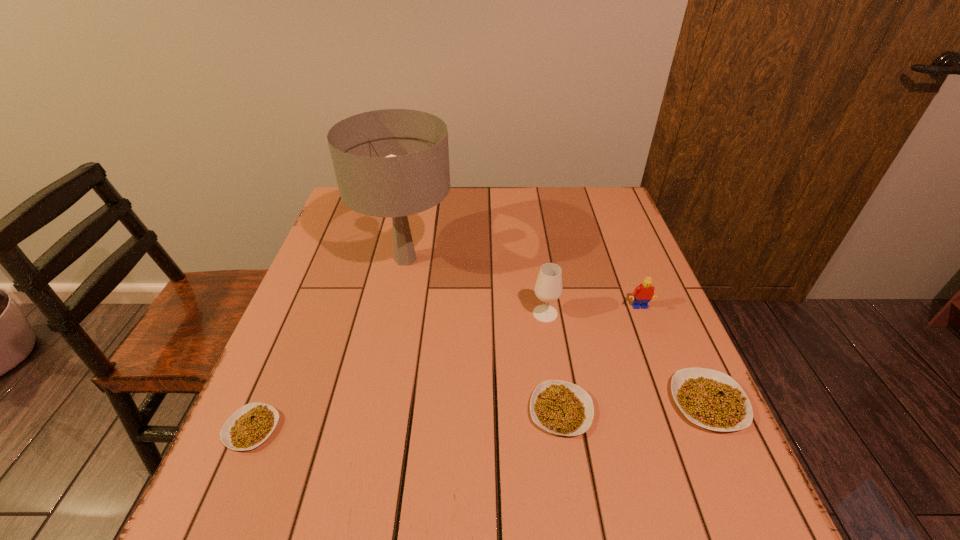
You are a GUI agent. You are given a task and a screenshot of the screen. Output one action in this format:
    pyautogui.click(x=<x>, y=<y>)
    Task: Click on the leftmost object
    The height and width of the screenshot is (540, 960).
    Given the screenshot: What is the action you would take?
    pyautogui.click(x=252, y=424)

You are a GUI agent. You are given a task and a screenshot of the screen. Output one action in this format:
    pyautogui.click(x=<x>, y=<y>)
    Task: Click on the leftmost legume
    The image size is (960, 540).
    Given the screenshot: What is the action you would take?
    pyautogui.click(x=252, y=424)

Locate an element on the screen. Image resolution: width=960 pixels, height=540 pixels. the second shortest legume is located at coordinates (560, 407).

Identify the location of the second shortest object. The height and width of the screenshot is (540, 960). (560, 407).

The height and width of the screenshot is (540, 960). I want to click on the rightmost legume, so click(711, 399).

I want to click on the fourth tallest object, so point(711,399).

I want to click on lampshade, so click(394, 163).

Where is `the second object from left to right`? The height and width of the screenshot is (540, 960). the second object from left to right is located at coordinates (394, 163).

At what (x,y) coordinates should I click in order to perform the action: click on glass. Please return your answer as a coordinate pair (x, y). Looking at the image, I should click on (548, 288).

Where is `the fourth shortest object`? This screenshot has height=540, width=960. the fourth shortest object is located at coordinates (643, 293).